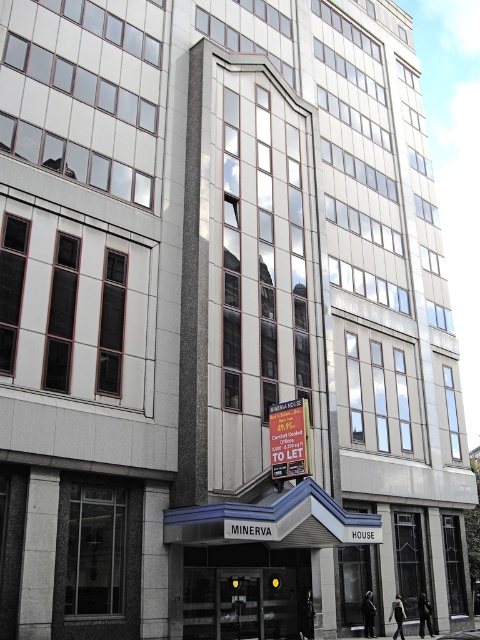
You are a delivery person approaching the entrance of the building. You need to hand over a package to the receptionist inside. The doors are locked, and you see the transparent glass doors at center and the yellow paper sign at center. Which object is taller so you can reach it without bending down?

The yellow paper sign at center is taller than the transparent glass doors at center, so you can reach it without bending down.